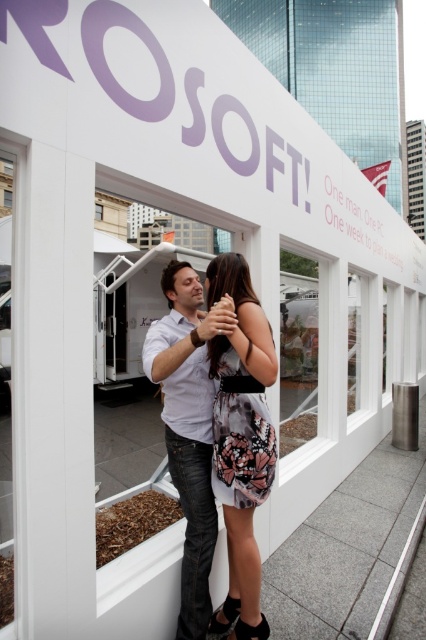
Measure the distance between point (x=236, y=627) and camera.

Point (x=236, y=627) is 2.28 meters away from camera.

Which is in front, point (218, 273) or point (204, 497)?

Point (204, 497) is more forward.

Find the location of `floral-patterned dress at center`. floral-patterned dress at center is located at coordinates (241, 436).

Locate an element on the screen. Image resolution: width=426 pixels, height=640 pixels. floral-patterned dress at center is located at coordinates (241, 436).